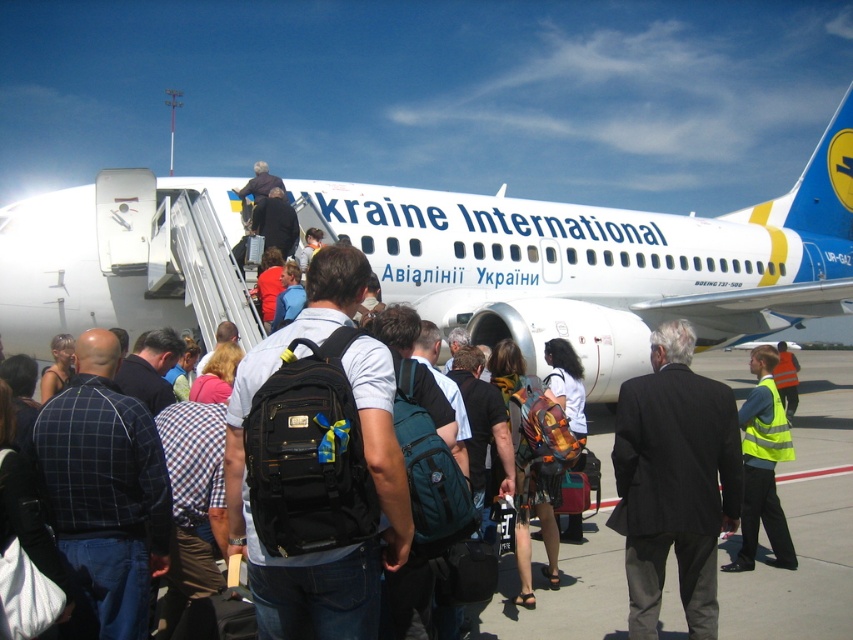
Does point (521, 259) lie in front of point (772, 541)?

That is False.

Does white matte airplane at center have a larger size compared to yellow reflective vest at center?

Correct, white matte airplane at center is larger in size than yellow reflective vest at center.

Who is more distant from viewer, (339,195) or (740,550)?

Point (339,195)

You are a GUI agent. You are given a task and a screenshot of the screen. Output one action in this format:
    pyautogui.click(x=<x>, y=<y>)
    Task: Click on the white matte airplane at center
    This screenshot has height=640, width=853.
    Given the screenshot: What is the action you would take?
    pyautogui.click(x=605, y=260)

Does dark gray suit at center have a lesser width compared to yellow reflective vest at center?

No, dark gray suit at center is not thinner than yellow reflective vest at center.

Between dark gray suit at center and yellow reflective vest at center, which one is positioned higher?

dark gray suit at center

Is point (694, 396) less distant than point (779, 557)?

Yes, point (694, 396) is in front of point (779, 557).

You are a GUI agent. You are given a task and a screenshot of the screen. Output one action in this format:
    pyautogui.click(x=<x>, y=<y>)
    Task: Click on the dark gray suit at center
    The image size is (853, 640).
    Given the screenshot: What is the action you would take?
    pyautogui.click(x=674, y=481)

Who is lower down, white matte airplane at center or dark gray suit at center?

dark gray suit at center

I want to click on white matte airplane at center, so click(605, 260).

The image size is (853, 640). What do you see at coordinates (605, 260) in the screenshot?
I see `white matte airplane at center` at bounding box center [605, 260].

This screenshot has height=640, width=853. What are the coordinates of `white matte airplane at center` in the screenshot? It's located at (605, 260).